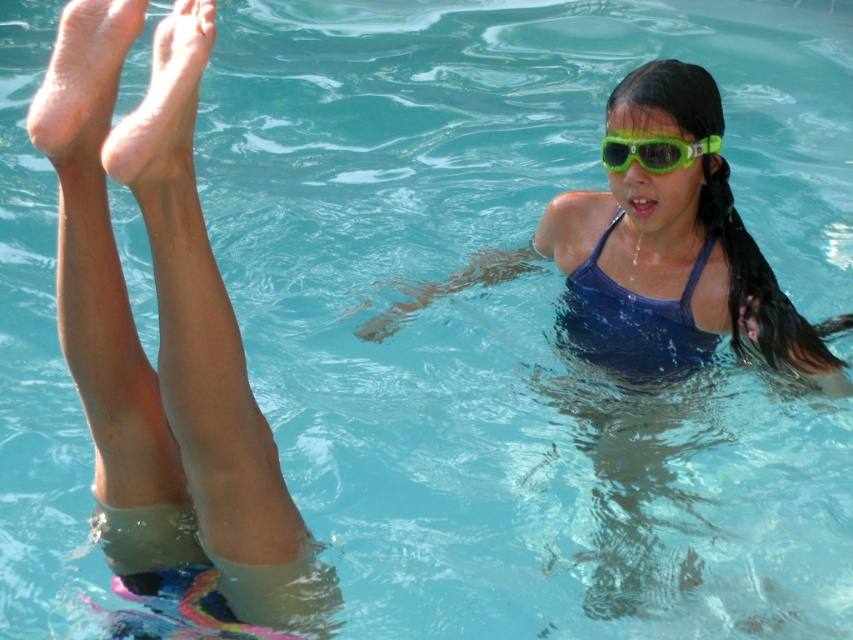
You are standing at the edge of the pool and see two points in the water labeled as point (675, 365) and point (647, 166). Which point is closer to you?

Point (647, 166) is closer to you because it is less further than point (675, 365).

You are a lifeguard observing the pool. You notice the pale skin feet at upper left and the green matte goggles at upper center. Which object is positioned lower in the image?

The pale skin feet at upper left is located below green matte goggles at upper center, so the pale skin feet at upper left is positioned lower in the image.